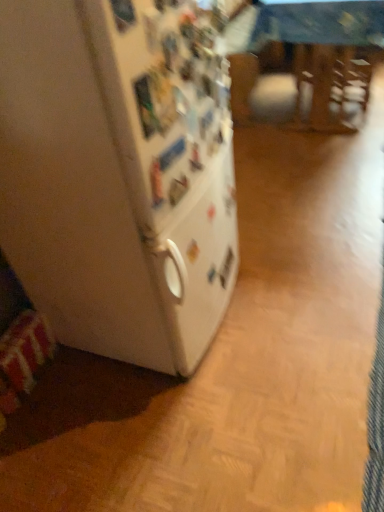
Question: Should I look upward or downward to see white matte refrigerator at left?

Choices:
 (A) up
 (B) down

Answer: (A)

Question: Is wooden table at center behind white matte refrigerator at left?

Choices:
 (A) yes
 (B) no

Answer: (A)

Question: Is wooden table at center turned away from white matte refrigerator at left?

Choices:
 (A) yes
 (B) no

Answer: (B)

Question: Considering the relative sizes of wooden table at center and white matte refrigerator at left in the image provided, is wooden table at center wider than white matte refrigerator at left?

Choices:
 (A) no
 (B) yes

Answer: (B)

Question: Does wooden table at center have a lesser height compared to white matte refrigerator at left?

Choices:
 (A) no
 (B) yes

Answer: (B)

Question: Is wooden table at center oriented towards white matte refrigerator at left?

Choices:
 (A) no
 (B) yes

Answer: (A)

Question: Can you confirm if wooden table at center is smaller than white matte refrigerator at left?

Choices:
 (A) no
 (B) yes

Answer: (A)

Question: Is there a large distance between white matte refrigerator at left and wooden table at center?

Choices:
 (A) yes
 (B) no

Answer: (A)

Question: Considering the relative sizes of white matte refrigerator at left and wooden table at center in the image provided, is white matte refrigerator at left bigger than wooden table at center?

Choices:
 (A) no
 (B) yes

Answer: (A)

Question: Is the position of white matte refrigerator at left less distant than that of wooden table at center?

Choices:
 (A) no
 (B) yes

Answer: (B)

Question: Does white matte refrigerator at left have a lesser height compared to wooden table at center?

Choices:
 (A) no
 (B) yes

Answer: (A)

Question: Is white matte refrigerator at left wider than wooden table at center?

Choices:
 (A) yes
 (B) no

Answer: (B)

Question: From the image's perspective, would you say white matte refrigerator at left is shown under wooden table at center?

Choices:
 (A) yes
 (B) no

Answer: (A)

Question: In terms of width, does wooden table at center look wider or thinner when compared to white matte refrigerator at left?

Choices:
 (A) wide
 (B) thin

Answer: (A)